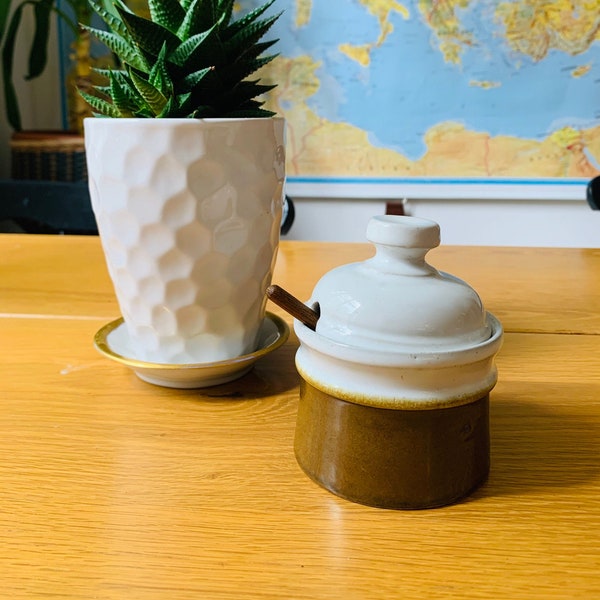
Locate an element on the screen. wood grain is located at coordinates (212, 432).